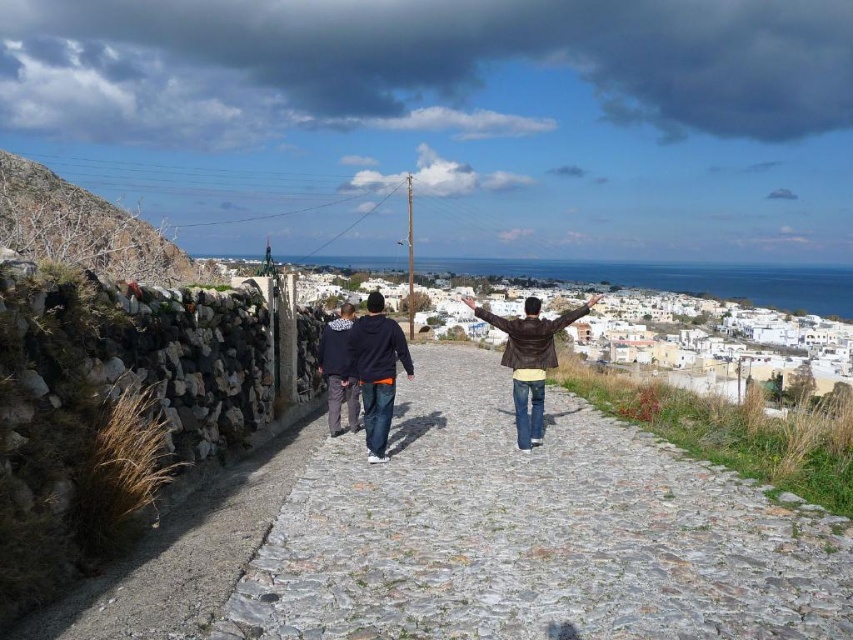
Does point (173, 266) come closer to viewer compared to point (381, 433)?

No, it is not.

The image size is (853, 640). Find the location of `brown rocky hill at left`. brown rocky hill at left is located at coordinates (86, 228).

Does dark blue hoodie at center appear over brown leather jacket at center?

Incorrect, dark blue hoodie at center is not positioned above brown leather jacket at center.

From the picture: Can you confirm if dark blue hoodie at center is wider than brown leather jacket at center?

In fact, dark blue hoodie at center might be narrower than brown leather jacket at center.

Between point (347, 337) and point (534, 424), which one is positioned in front?

Point (534, 424) is more forward.

The height and width of the screenshot is (640, 853). I want to click on dark blue hoodie at center, so click(x=372, y=369).

Can you confirm if gray cobblestone path at center is positioned above dark blue hoodie at center?

No, gray cobblestone path at center is not above dark blue hoodie at center.

Where is `gray cobblestone path at center`? This screenshot has width=853, height=640. gray cobblestone path at center is located at coordinates (532, 532).